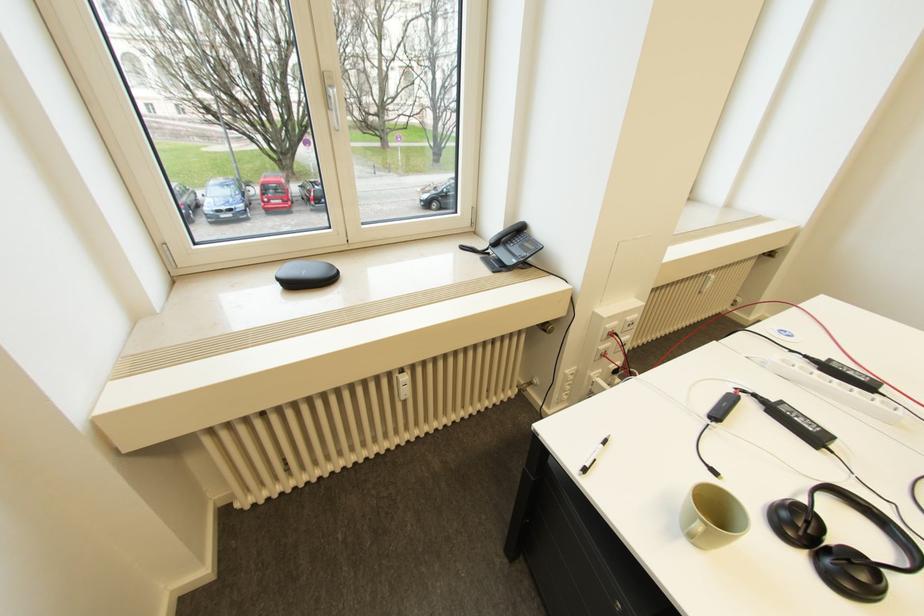
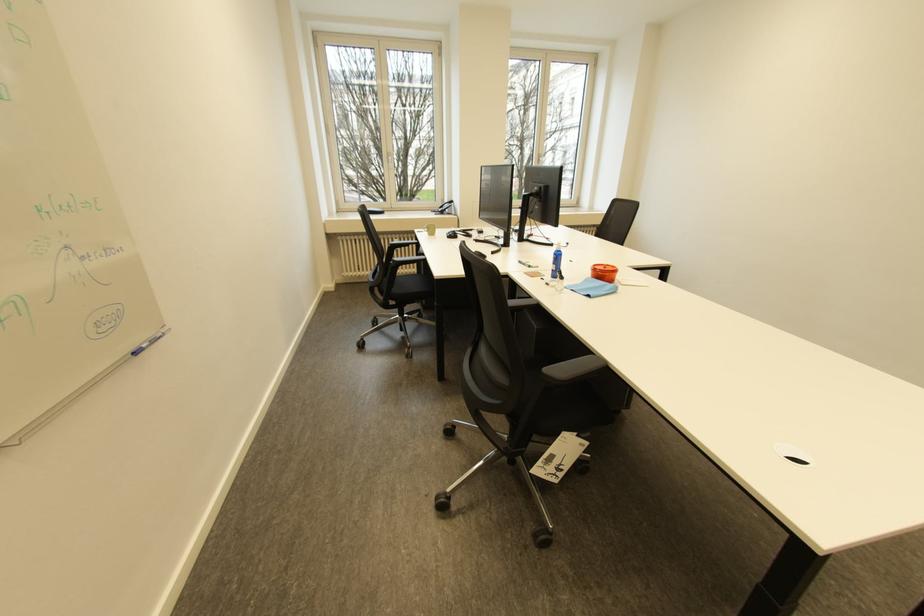
Locate, in the second image, the point that corresponds to point (594, 471) in the first image.

(428, 233)